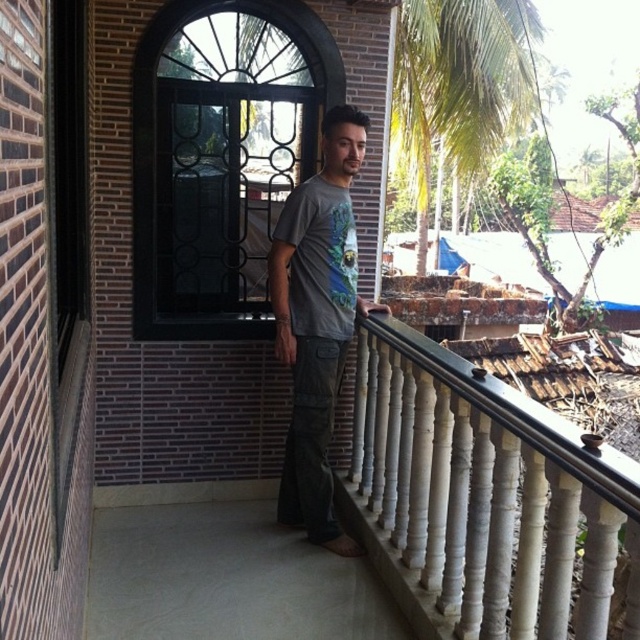
Question: Among these objects, which one is farthest from the camera?

Choices:
 (A) gray cotton t-shirt at center
 (B) green leafy palm tree at upper right

Answer: (B)

Question: Is white painted wood balustrade at center to the right of green leafy palm tree at upper right from the viewer's perspective?

Choices:
 (A) yes
 (B) no

Answer: (B)

Question: Among these points, which one is nearest to the camera?

Choices:
 (A) (483, 51)
 (B) (244, 273)

Answer: (B)

Question: Does black glass window at center come behind green leafy palm tree at upper right?

Choices:
 (A) yes
 (B) no

Answer: (B)

Question: Does white painted wood balustrade at center appear on the right side of gray cotton t-shirt at center?

Choices:
 (A) yes
 (B) no

Answer: (A)

Question: Which point is farther to the camera?

Choices:
 (A) green leafy palm tree at upper right
 (B) gray cotton t-shirt at center

Answer: (A)